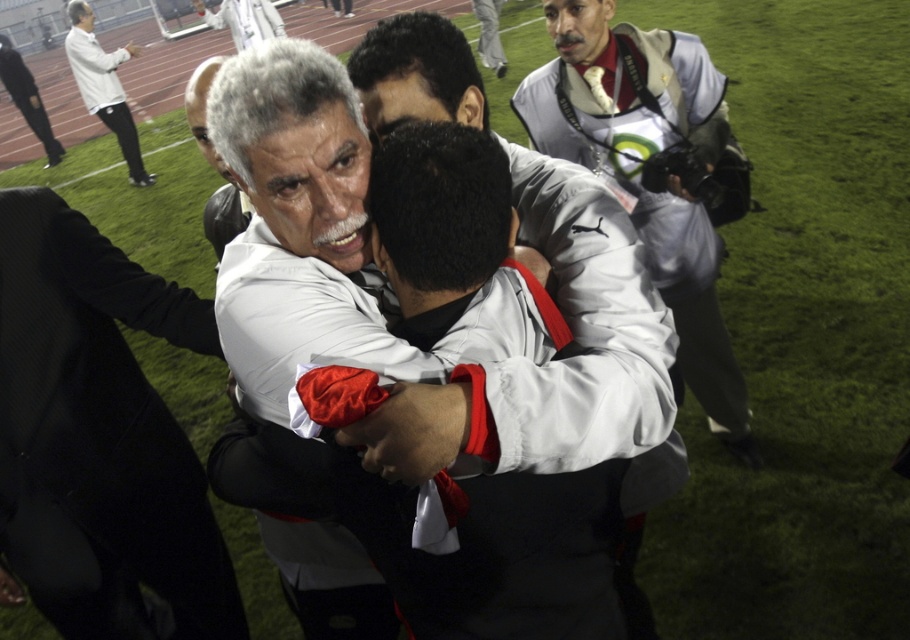
You are a photographer at the event and want to capture a photo of the black suit at center and the white matte jacket at upper left together. Based on their positions, which one should you focus on first to ensure both are in frame?

The black suit at center is positioned on the right side of white matte jacket at upper left, so you should focus on the white matte jacket at upper left first to ensure both are in frame.

You are a photographer at the event and want to capture a photo of both the white matte jacket at upper center and the white matte jacket at upper left in the same frame. Based on their positions, which jacket should you focus on first to ensure both are in the shot?

The white matte jacket at upper left should be focused on first since the white matte jacket at upper center is positioned to its right, meaning they are adjacent and both can be captured by centering the frame between them.

You are a photographer standing at the edge of the sports field. You need to take a picture of the black suit at center. Where should you position your camera to capture the subject clearly?

The black suit at center is located at point 0.684 on the x axis and 0.111 on the y axis, so position your camera directly facing that coordinate to capture it clearly.